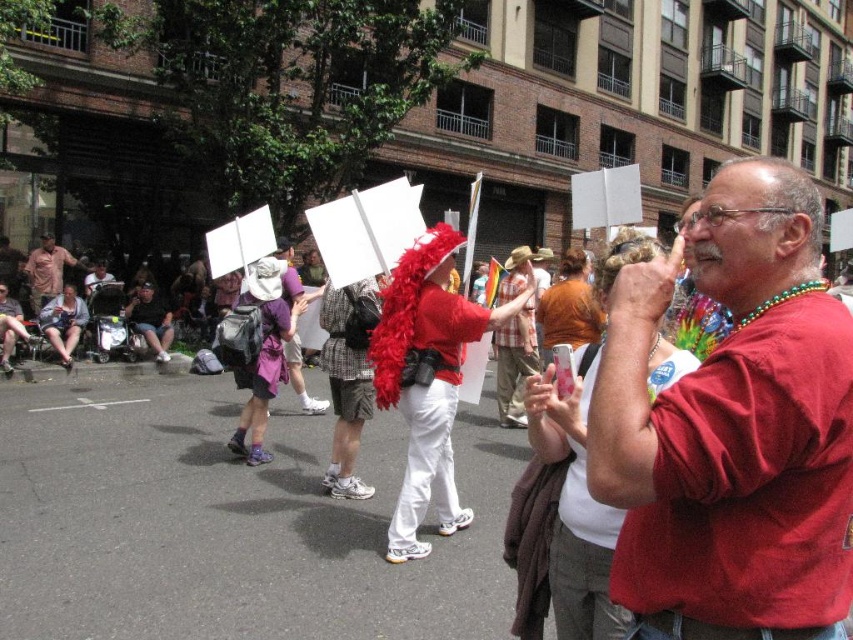
Question: Is matte red shirt at center positioned in front of feather boa at center?

Choices:
 (A) no
 (B) yes

Answer: (B)

Question: Which object is positioned closest to the matte pink shirt at center?

Choices:
 (A) feather boa at center
 (B) matte red shirt at center

Answer: (A)

Question: Estimate the real-world distances between objects in this image. Which object is closer to the matte pink shirt at center?

Choices:
 (A) purple fabric hat at center
 (B) matte red shirt at center
 (C) feather boa at center

Answer: (A)

Question: Among these points, which one is farthest from the camera?

Choices:
 (A) (428, 372)
 (B) (621, 532)
 (C) (300, 381)
 (D) (42, 268)

Answer: (D)

Question: Is feather boa at center bigger than matte pink shirt at center?

Choices:
 (A) no
 (B) yes

Answer: (B)

Question: Is feather boa at center bigger than matte pink shirt at center?

Choices:
 (A) yes
 (B) no

Answer: (A)